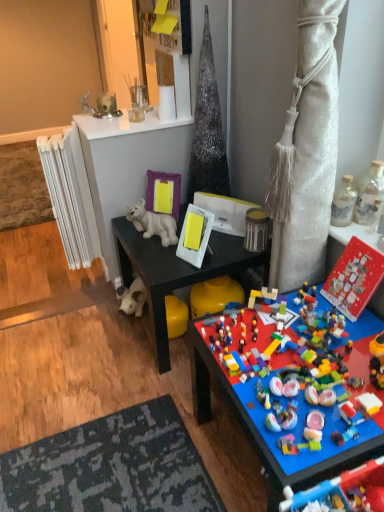
This screenshot has width=384, height=512. Identify the location of free space in front of black matte desk at center. (140, 417).